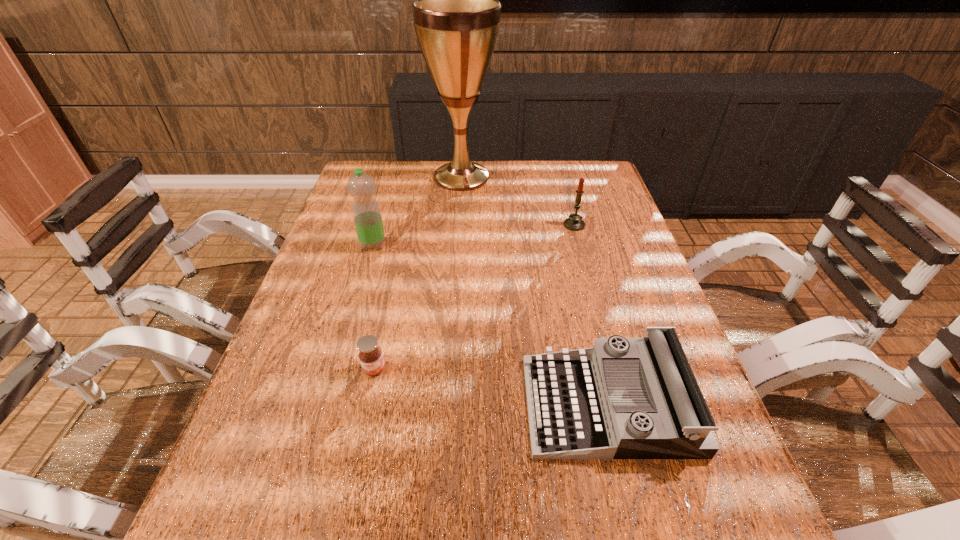
You are a GUI agent. You are given a task and a screenshot of the screen. Output one action in this format:
    pyautogui.click(x=<x>, y=<y>)
    Task: Click on the vacant position at the far edge of the desktop
    This screenshot has height=540, width=960.
    Given the screenshot: What is the action you would take?
    pyautogui.click(x=494, y=179)

What are the coordinates of `vacant space at the near edge` in the screenshot? It's located at (619, 524).

Locate an element on the screen. vacant area at the left edge is located at coordinates (293, 318).

At what (x,y) coordinates should I click in order to perform the action: click on vacant space at the right edge of the desktop. Please return your answer as a coordinate pair (x, y). Looking at the image, I should click on (612, 199).

The image size is (960, 540). In the image, there is a desktop. What are the coordinates of `free space at the far right corner` in the screenshot? It's located at (588, 167).

What are the coordinates of `blank space at the near right corner` in the screenshot? It's located at (759, 536).

The image size is (960, 540). I want to click on vacant area that lies between the second object from left to right and the trophy cup, so click(x=418, y=273).

You are a GUI agent. You are given a task and a screenshot of the screen. Output one action in this format:
    pyautogui.click(x=<x>, y=<y>)
    Task: Click on the free spot between the second shortest object and the fourth object from right to left
    Image resolution: width=960 pixels, height=540 pixels.
    Given the screenshot: What is the action you would take?
    point(492,387)

Locate an element on the screen. blank region between the jam and the candle is located at coordinates (474, 297).

The image size is (960, 540). What are the coordinates of `free point between the third shortest object and the typewriter` in the screenshot? It's located at (591, 315).